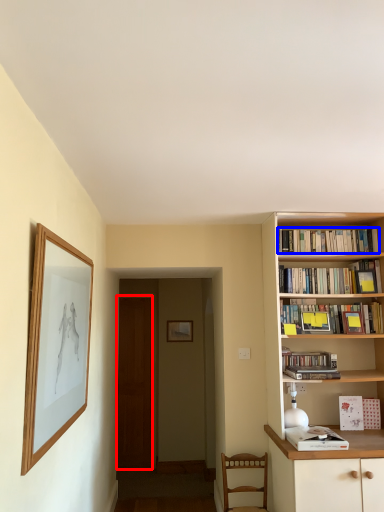
Question: Which of the following is the farthest to the observer, glass door (highlighted by a red box) or book (highlighted by a blue box)?

Choices:
 (A) glass door
 (B) book

Answer: (A)